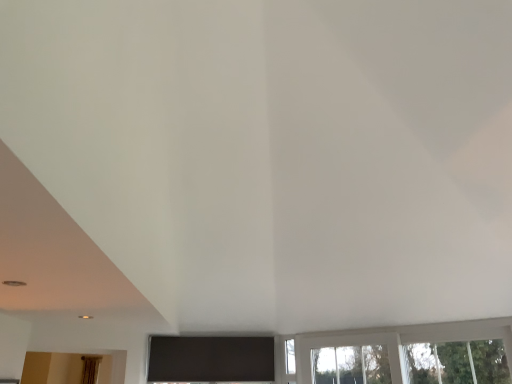
Question: From a real-world perspective, is transparent glass window at lower right positioned under brown fabric curtain at lower left based on gravity?

Choices:
 (A) no
 (B) yes

Answer: (A)

Question: Would you say transparent glass window at lower right contains brown fabric curtain at lower left?

Choices:
 (A) no
 (B) yes

Answer: (A)

Question: Does transparent glass window at lower right appear on the right side of brown fabric curtain at lower left?

Choices:
 (A) yes
 (B) no

Answer: (A)

Question: Does transparent glass window at lower right have a greater width compared to brown fabric curtain at lower left?

Choices:
 (A) no
 (B) yes

Answer: (A)

Question: Can you confirm if transparent glass window at lower right is taller than brown fabric curtain at lower left?

Choices:
 (A) yes
 (B) no

Answer: (B)

Question: From a real-world perspective, does transparent glass window at lower right stand above brown fabric curtain at lower left?

Choices:
 (A) no
 (B) yes

Answer: (B)

Question: From the image's perspective, does brown fabric curtain at lower left appear higher than transparent glass window at lower right?

Choices:
 (A) yes
 (B) no

Answer: (B)

Question: Is the surface of brown fabric curtain at lower left in direct contact with transparent glass window at lower right?

Choices:
 (A) no
 (B) yes

Answer: (A)

Question: Does brown fabric curtain at lower left come behind transparent glass window at lower right?

Choices:
 (A) yes
 (B) no

Answer: (A)

Question: Is brown fabric curtain at lower left not close to transparent glass window at lower right?

Choices:
 (A) no
 (B) yes

Answer: (B)

Question: Considering the relative sizes of brown fabric curtain at lower left and transparent glass window at lower right in the image provided, is brown fabric curtain at lower left shorter than transparent glass window at lower right?

Choices:
 (A) yes
 (B) no

Answer: (B)

Question: Can you confirm if brown fabric curtain at lower left is smaller than transparent glass window at lower right?

Choices:
 (A) no
 (B) yes

Answer: (B)

Question: Is transparent glass window at lower right to the left or to the right of brown fabric curtain at lower left in the image?

Choices:
 (A) right
 (B) left

Answer: (A)